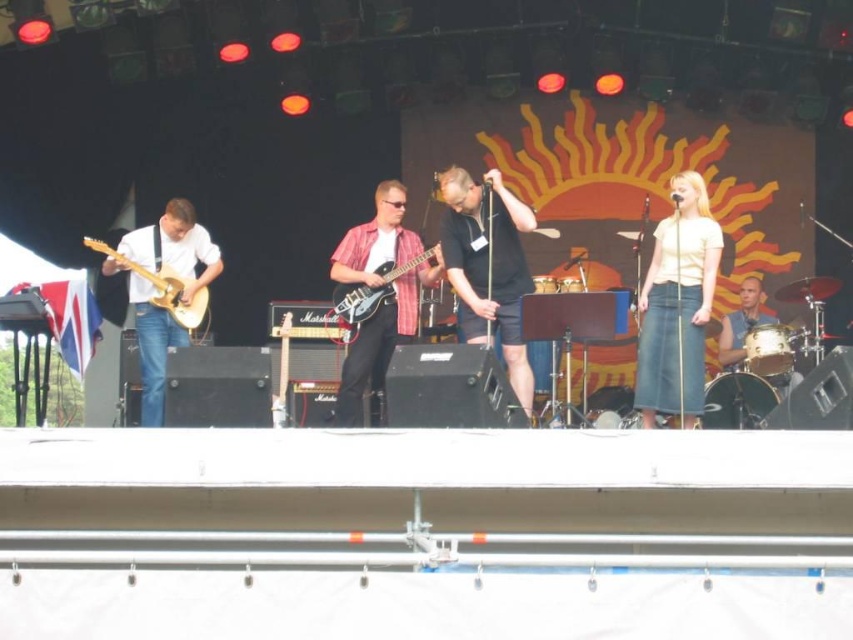
You are a photographer positioned at the back of the stage, aiming to capture a clear shot of both the white denim skirt at right and the matte wood guitar at left. Based on their positions, which object will appear larger in your photo?

The white denim skirt at right will appear larger in the photo because it is closer to the viewer than the matte wood guitar at left.

You are a photographer standing at the camera position. You want to capture a closeup shot of the matte black electric guitar at center. Given that your telephoto lens can focus objects up to 100 feet away, will you be able to take the closeup?

The distance between the matte black electric guitar at center and the camera is 128.62 feet. Since the telephoto lens can only focus up to 100 feet, you won cannot take the closeup as the distance exceeds the lens capability.